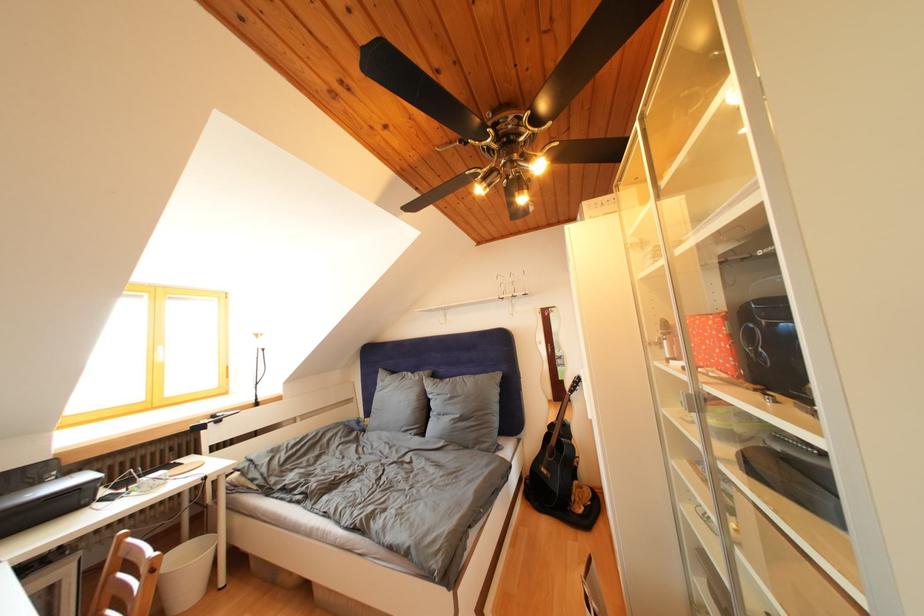
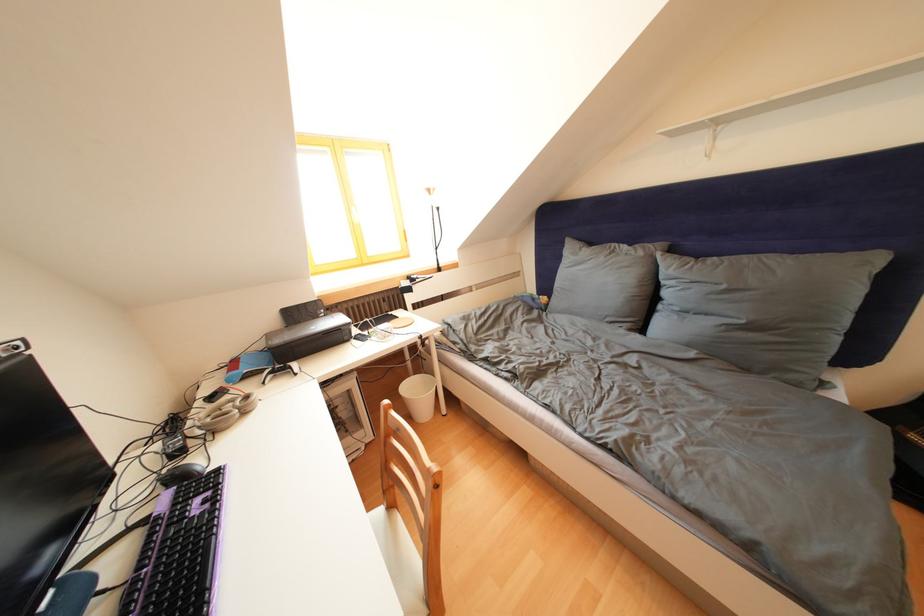
In the second image, find the point that corresponds to point 44,488 in the first image.

(323, 322)